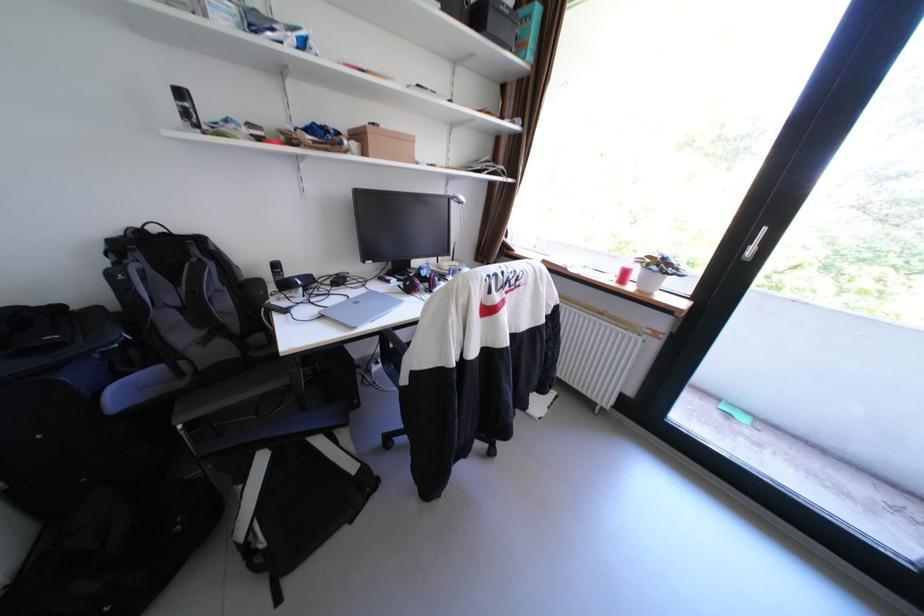
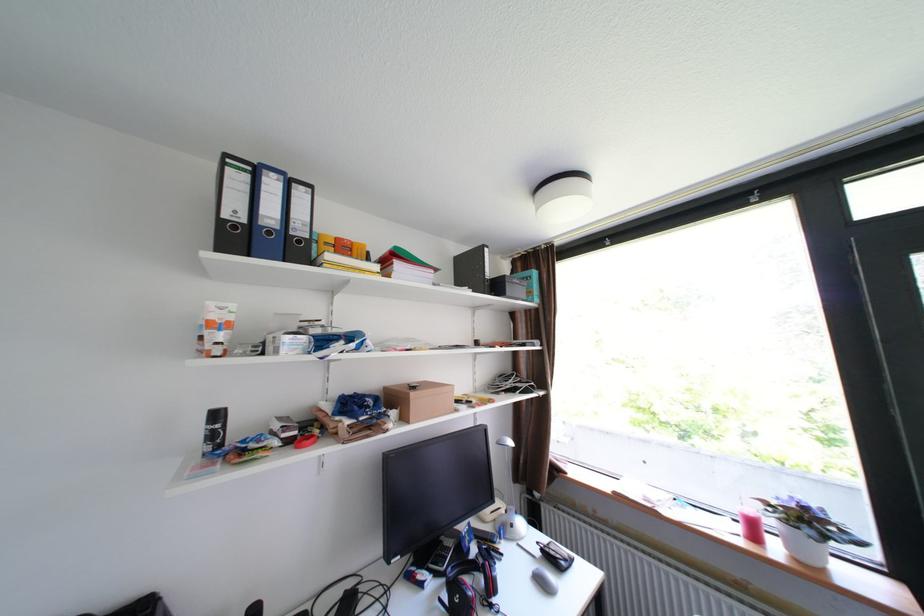
Question: The first image is from the beginning of the video and the second image is from the end. How did the camera likely rotate when shooting the video?

Choices:
 (A) Left
 (B) Right
 (C) Up
 (D) Down

Answer: (C)